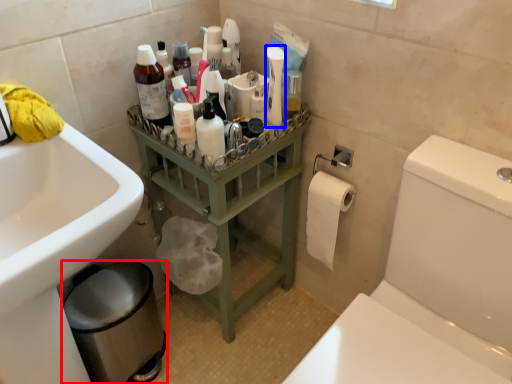
Question: Among these objects, which one is farthest to the camera, bidet (highlighted by a red box) or cleaning product (highlighted by a blue box)?

Choices:
 (A) bidet
 (B) cleaning product

Answer: (A)